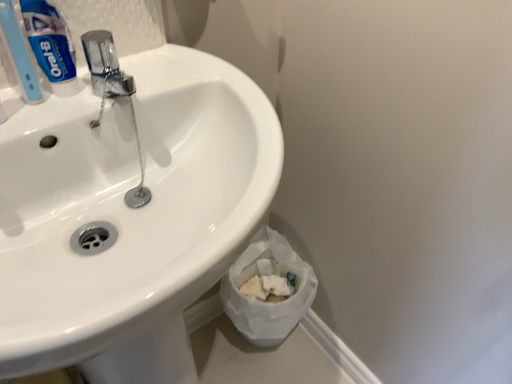
Question: Are blue glossy toothpaste at upper left and light blue plastic toothbrush at upper left beside each other?

Choices:
 (A) yes
 (B) no

Answer: (A)

Question: Can you confirm if blue glossy toothpaste at upper left is thinner than light blue plastic toothbrush at upper left?

Choices:
 (A) yes
 (B) no

Answer: (B)

Question: From a real-world perspective, is blue glossy toothpaste at upper left under light blue plastic toothbrush at upper left?

Choices:
 (A) no
 (B) yes

Answer: (B)

Question: Is blue glossy toothpaste at upper left in front of light blue plastic toothbrush at upper left?

Choices:
 (A) no
 (B) yes

Answer: (A)

Question: Considering the relative positions of blue glossy toothpaste at upper left and light blue plastic toothbrush at upper left in the image provided, is blue glossy toothpaste at upper left to the right of light blue plastic toothbrush at upper left from the viewer's perspective?

Choices:
 (A) yes
 (B) no

Answer: (A)

Question: In the image, is light blue plastic toothbrush at upper left positioned in front of or behind white glossy sink at upper left?

Choices:
 (A) behind
 (B) front

Answer: (A)

Question: Looking at the image, does light blue plastic toothbrush at upper left seem bigger or smaller compared to white glossy sink at upper left?

Choices:
 (A) big
 (B) small

Answer: (B)

Question: Is light blue plastic toothbrush at upper left wider or thinner than white glossy sink at upper left?

Choices:
 (A) thin
 (B) wide

Answer: (A)

Question: Would you say light blue plastic toothbrush at upper left is to the left or to the right of white glossy sink at upper left in the picture?

Choices:
 (A) right
 (B) left

Answer: (B)

Question: Looking at the image, does white crumpled paper at lower right seem bigger or smaller compared to white glossy sink at upper left?

Choices:
 (A) small
 (B) big

Answer: (A)

Question: Would you say white crumpled paper at lower right is inside or outside white glossy sink at upper left?

Choices:
 (A) inside
 (B) outside

Answer: (B)

Question: From a real-world perspective, is white crumpled paper at lower right physically located above or below white glossy sink at upper left?

Choices:
 (A) above
 (B) below

Answer: (B)

Question: In the image, is white crumpled paper at lower right on the left side or the right side of white glossy sink at upper left?

Choices:
 (A) left
 (B) right

Answer: (B)

Question: In the image, is white glossy sink at upper left positioned in front of or behind light blue plastic toothbrush at upper left?

Choices:
 (A) behind
 (B) front

Answer: (B)

Question: Is point (242, 221) positioned closer to the camera than point (20, 34)?

Choices:
 (A) farther
 (B) closer

Answer: (B)